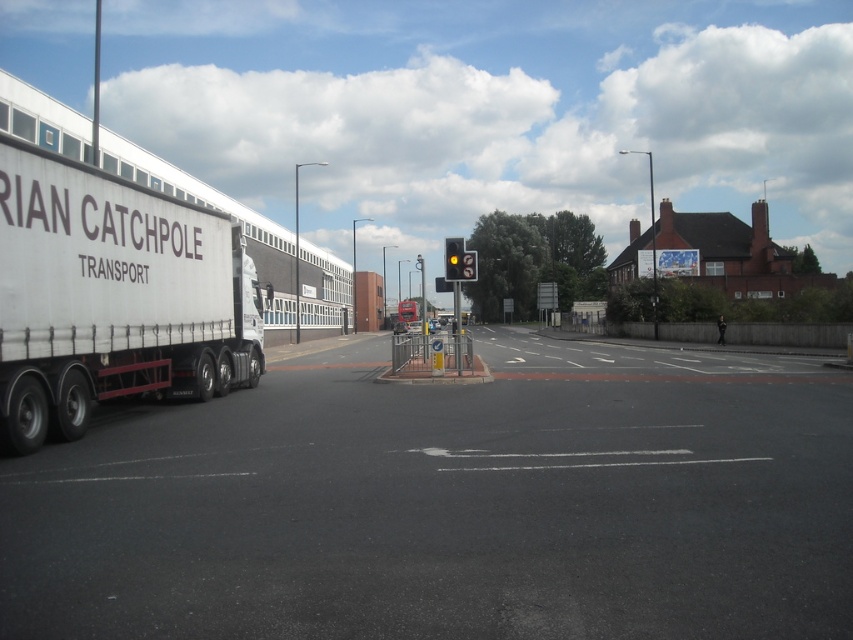
Which is more to the left, white matte trailer truck at left or yellow matte traffic light at center?

white matte trailer truck at left

Who is more distant from viewer, (198, 392) or (462, 250)?

The point (462, 250) is behind.

This screenshot has width=853, height=640. In order to click on white matte trailer truck at left in this screenshot , I will do (112, 296).